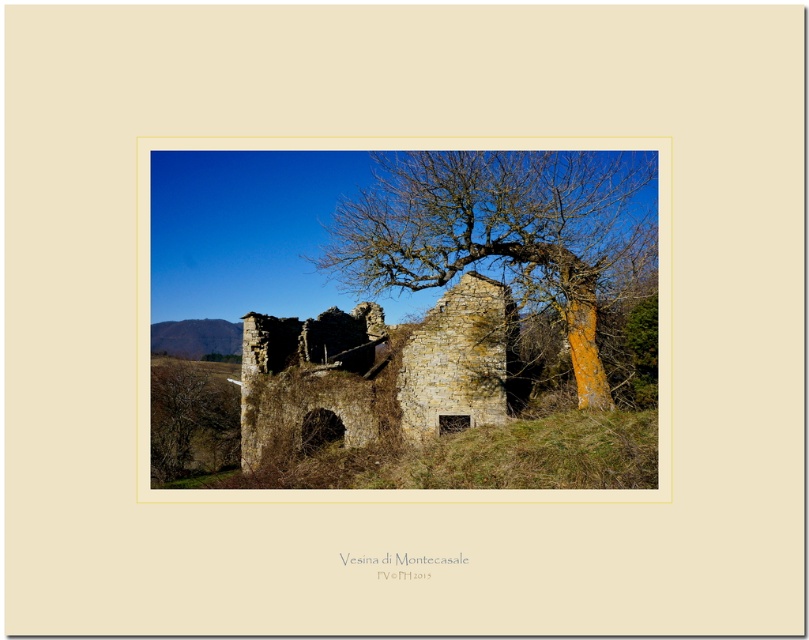
You are standing at the point with coordinates point (231, 428) and want to walk towards the old stone structure. Will you pass by point (443, 296) along the way?

Yes, because point (443, 296) is in front of point (231, 428), so you will pass by it on your way to the old stone structure.